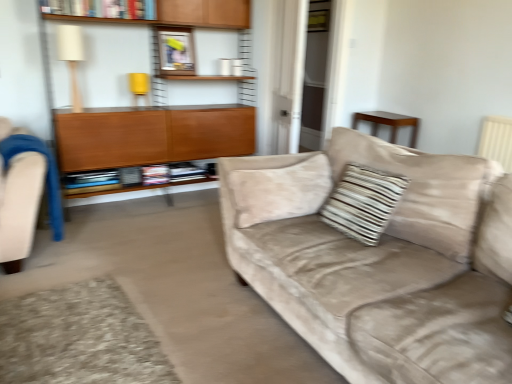
Question: Is wooden cabinet at left to the left or to the right of striped fabric pillow at center in the image?

Choices:
 (A) right
 (B) left

Answer: (B)

Question: Is wooden cabinet at left taller or shorter than striped fabric pillow at center?

Choices:
 (A) short
 (B) tall

Answer: (B)

Question: Estimate the real-world distances between objects in this image. Which object is closer to the white fabric lampshade at upper left?

Choices:
 (A) brown wooden table at upper right
 (B) blue fabric swivel chair at left
 (C) wooden cabinet at left
 (D) suede beige couch at center
 (E) striped fabric pillow at center

Answer: (C)

Question: Estimate the real-world distances between objects in this image. Which object is farther from the wooden cabinet at left?

Choices:
 (A) suede beige couch at center
 (B) wooden shelf at center, marked as the 2th book in a top-to-bottom arrangement
 (C) striped fabric pillow at center
 (D) blue fabric swivel chair at left
 (E) hardcover book at upper center, which appears as the first book when viewed from the top

Answer: (A)